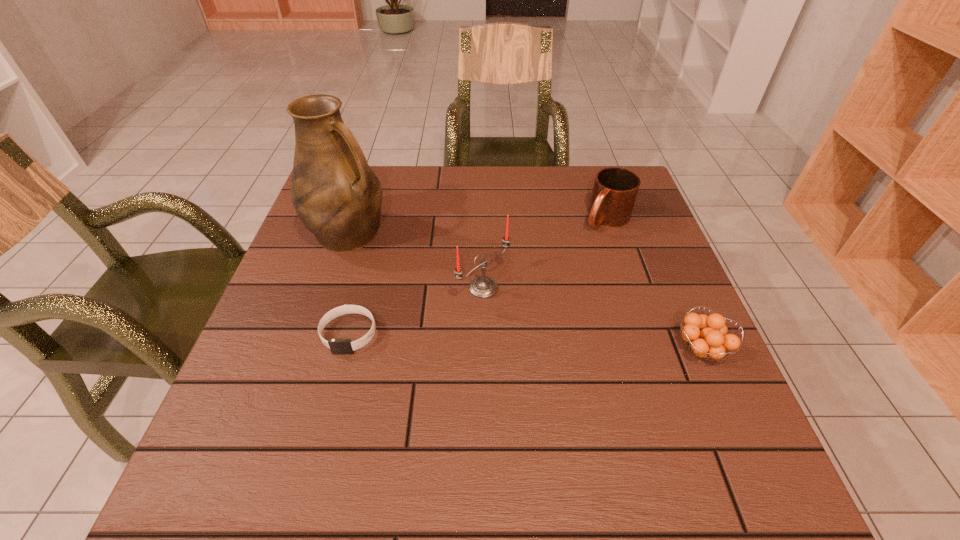
At what (x,y) coordinates should I click in order to perform the action: click on the shortest object. Please return your answer as a coordinate pair (x, y). Looking at the image, I should click on (338, 346).

Identify the location of orange fruit. (706, 336).

The height and width of the screenshot is (540, 960). Find the location of `the tallest object`. the tallest object is located at coordinates (336, 195).

Identify the location of the third nearest object. Image resolution: width=960 pixels, height=540 pixels. (481, 287).

Find the location of a particular element. This screenshot has height=540, width=960. the second tallest object is located at coordinates (481, 287).

I want to click on mug, so click(x=615, y=190).

Where is `vacant space situated 0.150m on the outer surface of the shortest object`? The height and width of the screenshot is (540, 960). vacant space situated 0.150m on the outer surface of the shortest object is located at coordinates (324, 427).

This screenshot has width=960, height=540. What are the coordinates of `vacant position located on the back of the orange fruit` in the screenshot? It's located at (660, 253).

The height and width of the screenshot is (540, 960). I want to click on vacant position located 0.340m on the handle side of the tallest object, so click(x=486, y=316).

This screenshot has width=960, height=540. In order to click on free space located on the handle side of the tallest object in this screenshot , I will do `click(486, 316)`.